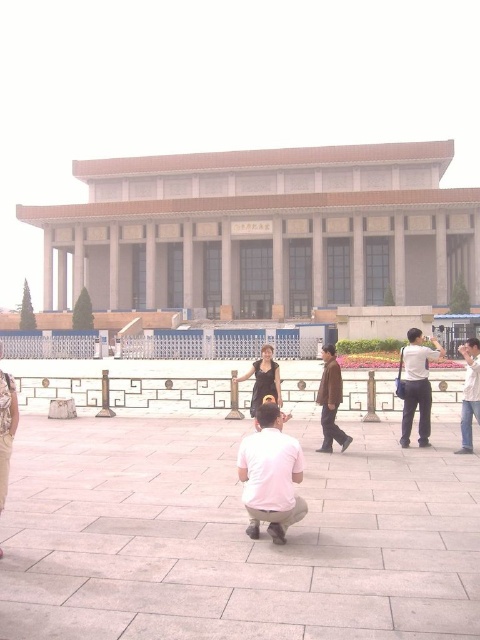
You are standing in front of a large classical building and see two people at the center wearing the white matte shirt at center and the brown leather jacket at center. Which person is positioned to the left?

The white matte shirt at center is to the left of the brown leather jacket at center, so the person wearing the white matte shirt at center is positioned to the left.

You are standing in front of a large classical building and see a brown leather jacket at center. Where exactly is the brown leather jacket positioned in relation to the building?

The brown leather jacket at center is located at point coordinates of 0.628 on the x axis and 0.690 on the y axis.

You are standing in front of a large classical building and see two people. One is wearing light gray pants at right and the other is wearing a brown leather jacket at center. Which person is positioned more to the right side?

The light gray pants at right are to the right of the brown leather jacket at center, so the person wearing light gray pants at right is positioned more to the right side.